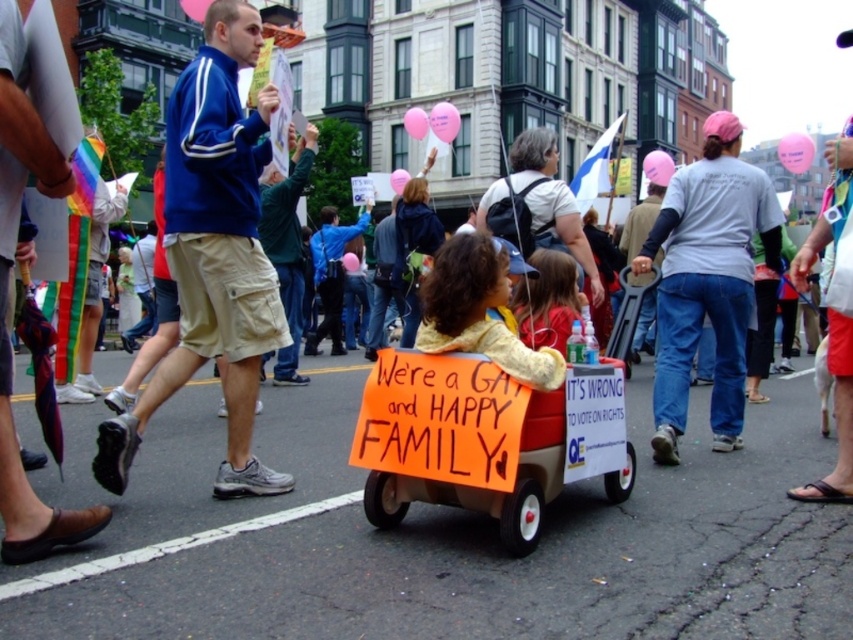
Does gray cotton shirt at center appear on the left side of matte white shirt at center?

No, gray cotton shirt at center is not to the left of matte white shirt at center.

Who is shorter, gray cotton shirt at center or matte white shirt at center?

gray cotton shirt at center

Is point (764, 196) farther from viewer compared to point (521, 241)?

No, it is not.

Image resolution: width=853 pixels, height=640 pixels. In order to click on gray cotton shirt at center in this screenshot , I will do `click(706, 280)`.

Can you confirm if blue fabric jacket at center is thinner than matte white shirt at center?

Correct, blue fabric jacket at center's width is less than matte white shirt at center's.

Can you confirm if blue fabric jacket at center is smaller than matte white shirt at center?

Correct, blue fabric jacket at center occupies less space than matte white shirt at center.

Who is more forward, (x=192, y=278) or (x=560, y=244)?

Point (x=192, y=278)

What are the coordinates of `blue fabric jacket at center` in the screenshot? It's located at (213, 253).

How distant is blue fabric jacket at center from orange cardboard wagon at center?

They are 2.96 meters apart.

Consider the image. Between blue fabric jacket at center and orange cardboard wagon at center, which one is positioned lower?

Positioned lower is orange cardboard wagon at center.

Find the location of a particular element. The height and width of the screenshot is (640, 853). blue fabric jacket at center is located at coordinates (213, 253).